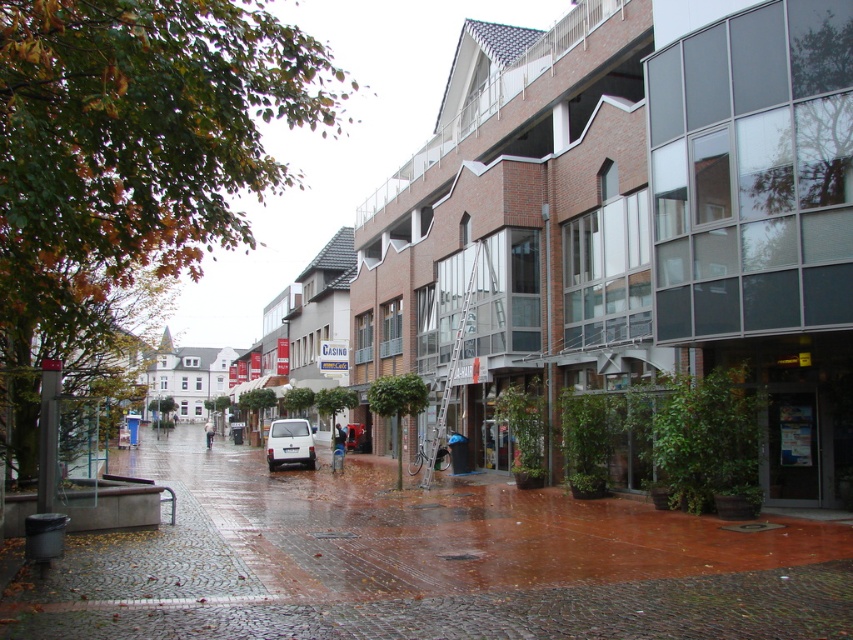
Question: From the image, what is the correct spatial relationship of brick pavement at center in relation to white matte van at center?

Choices:
 (A) right
 (B) left

Answer: (A)

Question: Which point is closer to the camera taking this photo?

Choices:
 (A) (279, 461)
 (B) (96, 536)

Answer: (B)

Question: Is brick pavement at center bigger than white matte van at center?

Choices:
 (A) yes
 (B) no

Answer: (A)

Question: Is brick pavement at center behind white matte van at center?

Choices:
 (A) no
 (B) yes

Answer: (A)